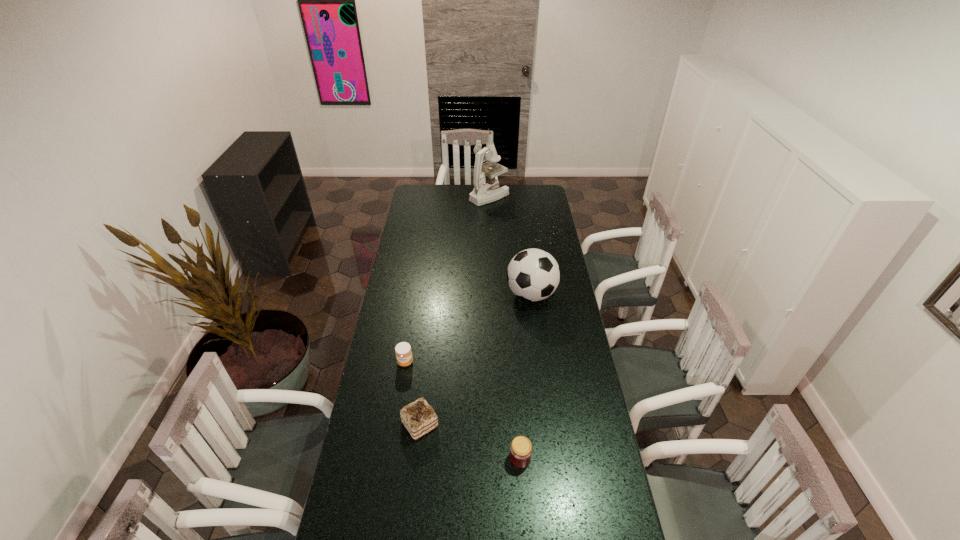
At what (x,y) coordinates should I click in order to perform the action: click on blank area located 0.230m on the left of the fourth shortest object. Please return your answer as a coordinate pair (x, y). The image size is (960, 540). Looking at the image, I should click on (457, 294).

Locate an element on the screen. blank area located 0.110m on the front label of the left jam is located at coordinates (400, 393).

Where is `vacant region located 0.190m on the front of the chocolate cake`? Image resolution: width=960 pixels, height=540 pixels. vacant region located 0.190m on the front of the chocolate cake is located at coordinates (412, 500).

Find the location of `free region located 0.100m on the right of the right jam`. free region located 0.100m on the right of the right jam is located at coordinates (562, 458).

You are a GUI agent. You are given a task and a screenshot of the screen. Output one action in this format:
    pyautogui.click(x=<x>, y=<y>)
    Task: Click on the object at the far edge
    The image size is (960, 540).
    Given the screenshot: What is the action you would take?
    pos(486,189)

In order to click on jam present at the left edge in this screenshot , I will do 403,351.

This screenshot has height=540, width=960. In order to click on chocolate cake positioned at the left edge in this screenshot , I will do `click(419, 418)`.

Locate an element on the screen. object that is at the right edge is located at coordinates (533, 274).

Locate an element on the screen. The image size is (960, 540). free space at the far edge of the desktop is located at coordinates (513, 202).

At what (x,y) coordinates should I click in order to perform the action: click on vacant space at the left edge. Please return your answer as a coordinate pair (x, y). This screenshot has width=960, height=540. Looking at the image, I should click on (400, 244).